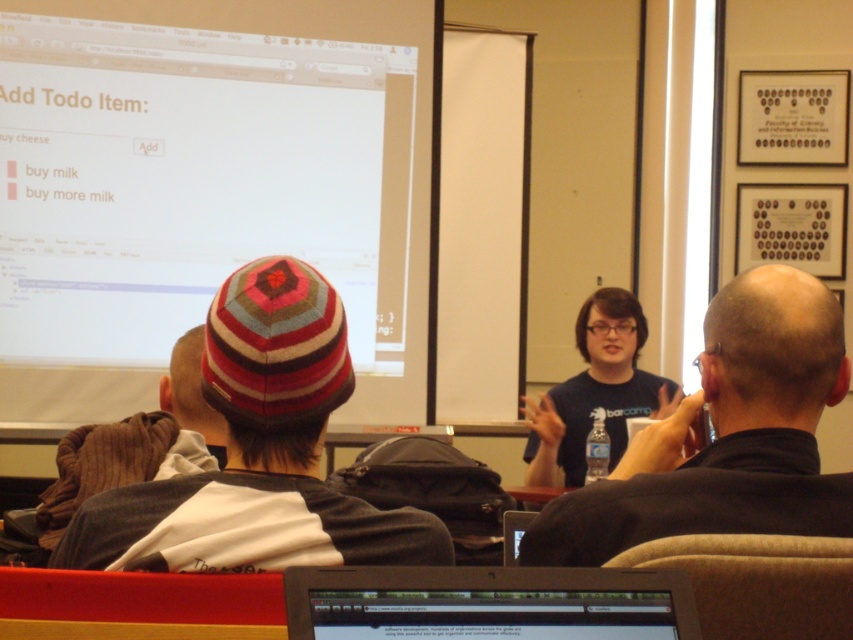
Between knitted woolen hat at center and silver plastic laptop at lower center, which one is positioned higher?

knitted woolen hat at center

Can you confirm if knitted woolen hat at center is wider than silver plastic laptop at lower center?

Correct, the width of knitted woolen hat at center exceeds that of silver plastic laptop at lower center.

Between point (247, 300) and point (445, 579), which one is positioned in front?

Point (445, 579) is more forward.

Locate an element on the screen. This screenshot has height=640, width=853. knitted woolen hat at center is located at coordinates (258, 452).

Does white matte projection screen at upper left have a lesser width compared to knitted wool hat at upper left?

Incorrect, white matte projection screen at upper left's width is not less than knitted wool hat at upper left's.

Does white matte projection screen at upper left appear under knitted wool hat at upper left?

No, white matte projection screen at upper left is not below knitted wool hat at upper left.

Describe the element at coordinates (206, 186) in the screenshot. I see `white matte projection screen at upper left` at that location.

Where is `white matte projection screen at upper left`? white matte projection screen at upper left is located at coordinates (206, 186).

Who is more forward, (490,612) or (625,372)?

Positioned in front is point (490,612).

Is point (535, 604) behind point (592, 356)?

No, (535, 604) is in front of (592, 356).

Who is more distant from viewer, (646, 577) or (595, 301)?

The point (595, 301) is more distant.

The image size is (853, 640). What are the coordinates of `silver plastic laptop at lower center` in the screenshot? It's located at (486, 604).